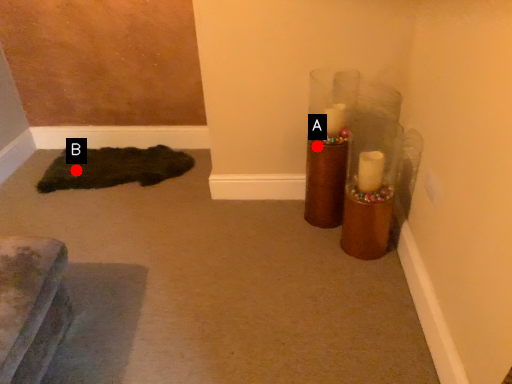
Question: Two points are circled on the image, labeled by A and B beside each circle. Which point is closer to the camera taking this photo?

Choices:
 (A) A is closer
 (B) B is closer

Answer: (A)